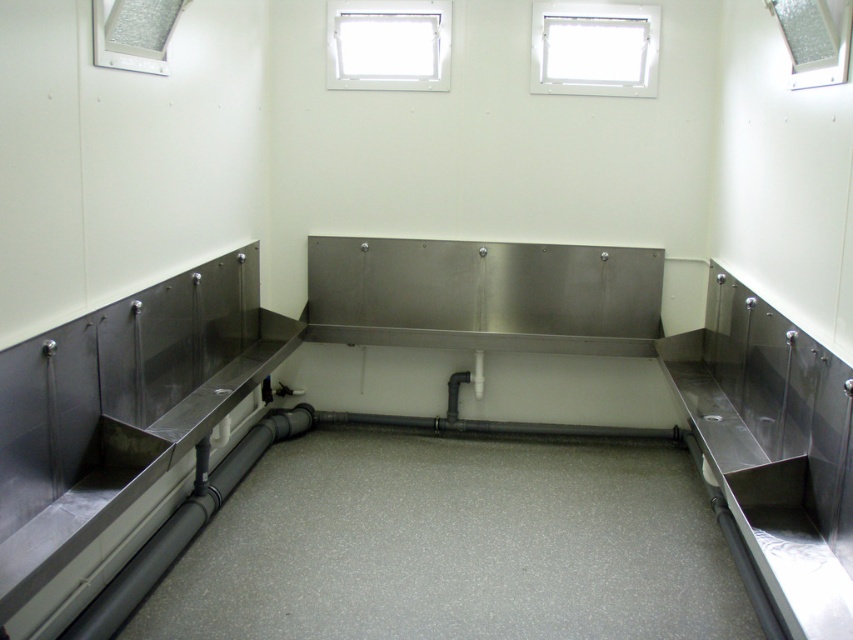
Between white plastic window at upper center and clear glass window at upper left, which one is positioned higher?

Positioned higher is white plastic window at upper center.

Is white plastic window at upper center wider than clear glass window at upper left?

Yes.

Where is `white plastic window at upper center`? The height and width of the screenshot is (640, 853). white plastic window at upper center is located at coordinates (595, 49).

This screenshot has width=853, height=640. In order to click on white plastic window at upper center in this screenshot , I will do click(x=595, y=49).

Is white plastic window at upper center below clear glass window at upper right?

Actually, white plastic window at upper center is above clear glass window at upper right.

Consider the image. Is white plastic window at upper center behind clear glass window at upper right?

Yes, white plastic window at upper center is behind clear glass window at upper right.

What do you see at coordinates (595, 49) in the screenshot? Image resolution: width=853 pixels, height=640 pixels. I see `white plastic window at upper center` at bounding box center [595, 49].

You are a GUI agent. You are given a task and a screenshot of the screen. Output one action in this format:
    pyautogui.click(x=<x>, y=<y>)
    Task: Click on the white plastic window at upper center
    This screenshot has width=853, height=640.
    Given the screenshot: What is the action you would take?
    pyautogui.click(x=595, y=49)

Does clear glass window at upper right appear on the left side of clear glass window at upper left?

No, clear glass window at upper right is not to the left of clear glass window at upper left.

Who is more forward, (786, 32) or (132, 26)?

Point (132, 26) is in front.

Where is `clear glass window at upper right`? This screenshot has height=640, width=853. clear glass window at upper right is located at coordinates (814, 38).